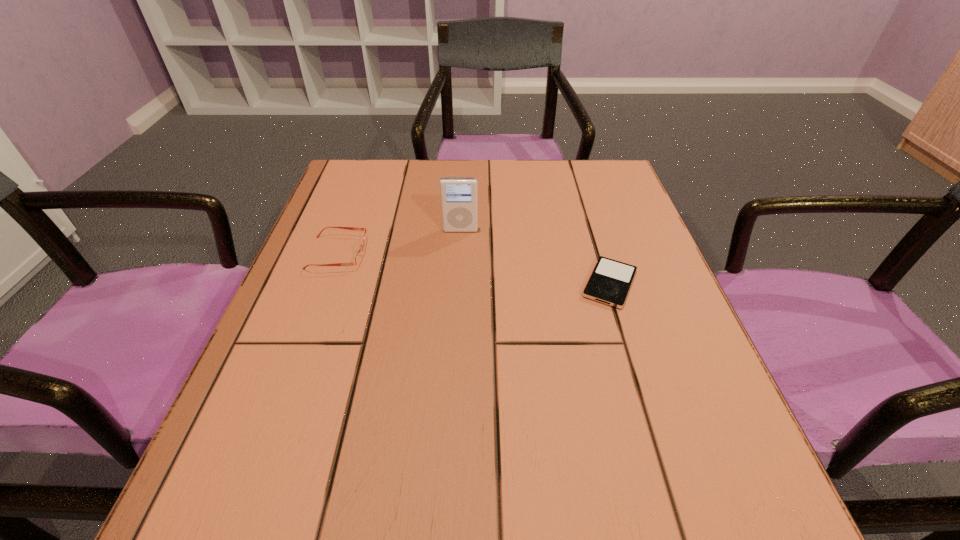
This screenshot has height=540, width=960. I want to click on free spot that satisfies the following two spatial constraints: 1. on the front-facing side of the farther iPod; 2. on the lenses of the second tallest object, so click(459, 253).

Identify the location of free space that satisfies the following two spatial constraints: 1. on the front-facing side of the farthest object; 2. on the lenses of the spectacles. (459, 253).

This screenshot has width=960, height=540. I want to click on free space that satisfies the following two spatial constraints: 1. on the front-facing side of the taller iPod; 2. on the right side of the right iPod, so click(x=458, y=284).

The width and height of the screenshot is (960, 540). Find the location of `vacant space that satisfies the following two spatial constraints: 1. on the front-facing side of the nearer iPod; 2. on the left side of the left iPod`. vacant space that satisfies the following two spatial constraints: 1. on the front-facing side of the nearer iPod; 2. on the left side of the left iPod is located at coordinates (458, 284).

Where is `free space that satisfies the following two spatial constraints: 1. on the front-facing side of the left iPod; 2. on the right side of the nearer iPod`? The image size is (960, 540). free space that satisfies the following two spatial constraints: 1. on the front-facing side of the left iPod; 2. on the right side of the nearer iPod is located at coordinates (458, 284).

Find the location of a particular element. This screenshot has height=540, width=960. free space that satisfies the following two spatial constraints: 1. on the front-facing side of the taller iPod; 2. on the lenses of the leftmost object is located at coordinates (459, 253).

Image resolution: width=960 pixels, height=540 pixels. Identify the location of free region that satisfies the following two spatial constraints: 1. on the front-facing side of the second object from right to left; 2. on the lenses of the leftmost object. (459, 253).

At what (x,y) coordinates should I click in order to perform the action: click on free space that satisfies the following two spatial constraints: 1. on the front-facing side of the second object from left to right; 2. on the lenses of the leftmost object. Please return your answer as a coordinate pair (x, y). Looking at the image, I should click on (459, 253).

Where is `free point that satisfies the following two spatial constraints: 1. on the front-facing side of the second object from left to right; 2. on the lenses of the leftmost object`? free point that satisfies the following two spatial constraints: 1. on the front-facing side of the second object from left to right; 2. on the lenses of the leftmost object is located at coordinates (459, 253).

Identify the location of free spot that satisfies the following two spatial constraints: 1. on the front-facing side of the nearer iPod; 2. on the right side of the farther iPod. Image resolution: width=960 pixels, height=540 pixels. tap(458, 284).